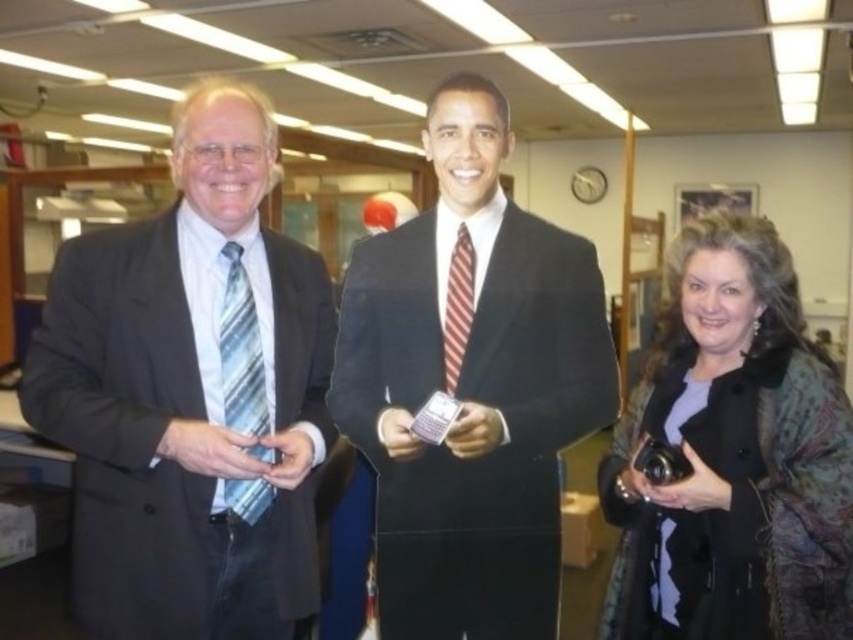
You are a photographer positioned at the camera. You need to take a portrait of the black velvet suit at center. Considering your current position, is the subject within a comfortable shooting distance for a standard portrait?

The black velvet suit at center is 1.18 meters away from the camera, which is a suitable distance for a standard portrait as it allows capturing the subject clearly without being too close or too far.

You are a photographer setting up for a group photo. You need to arrange the matte black suit at left and the black velvet suit at center so that they are aligned properly. Which one should be placed to the left to match their current positions?

The matte black suit at left should be placed to the left of the black velvet suit at center because it is already positioned on the left side of the black velvet suit at center in the current setup.

You are a photographer setting up for a group photo. You need to arrange the subjects so that the matte black suit at left and the black textured coat at lower right are visible without overlapping. Based on their positions, which one should you place higher in the frame?

The matte black suit at left is already positioned above the black textured coat at lower right, so to maintain visibility without overlapping, keep the matte black suit at left higher in the frame.